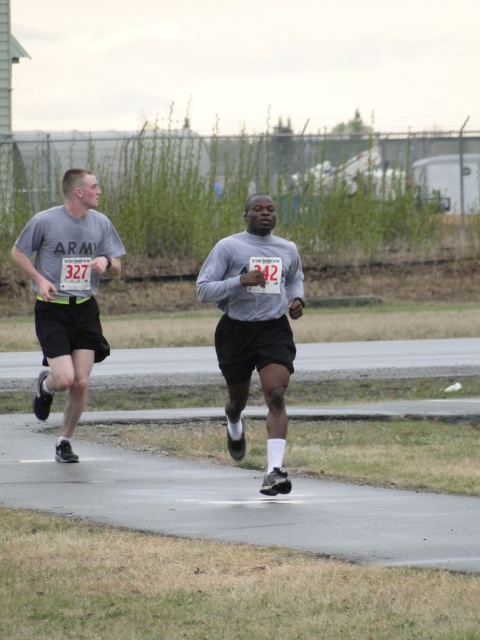
Question: Does gray asphalt pavement at center appear on the right side of gray matte shirt at center?

Choices:
 (A) yes
 (B) no

Answer: (B)

Question: Can you confirm if gray asphalt pavement at center is positioned to the left of matte gray shirt at left?

Choices:
 (A) yes
 (B) no

Answer: (B)

Question: Which point is farther to the camera?

Choices:
 (A) gray asphalt pavement at center
 (B) matte gray shirt at left

Answer: (B)

Question: Among these points, which one is farthest from the camera?

Choices:
 (A) (301, 492)
 (B) (294, 248)
 (C) (83, 282)

Answer: (C)

Question: Considering the real-world distances, which object is closest to the gray matte shirt at center?

Choices:
 (A) matte gray shirt at left
 (B) gray asphalt pavement at center

Answer: (B)

Question: From the image, what is the correct spatial relationship of gray asphalt pavement at center in relation to matte gray shirt at left?

Choices:
 (A) below
 (B) above

Answer: (A)